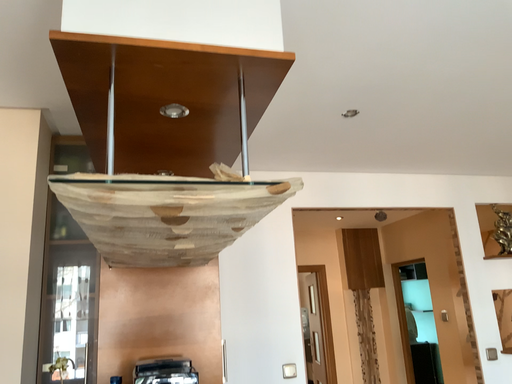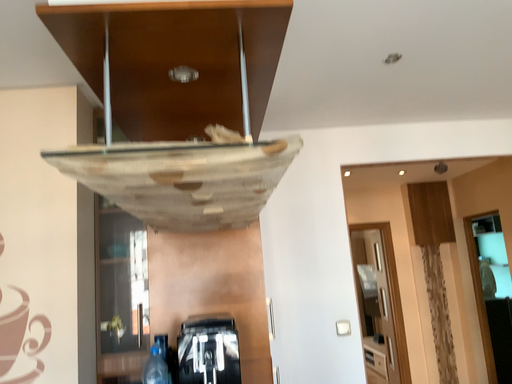
Question: How did the camera likely rotate when shooting the video?

Choices:
 (A) rotated left
 (B) rotated right

Answer: (A)